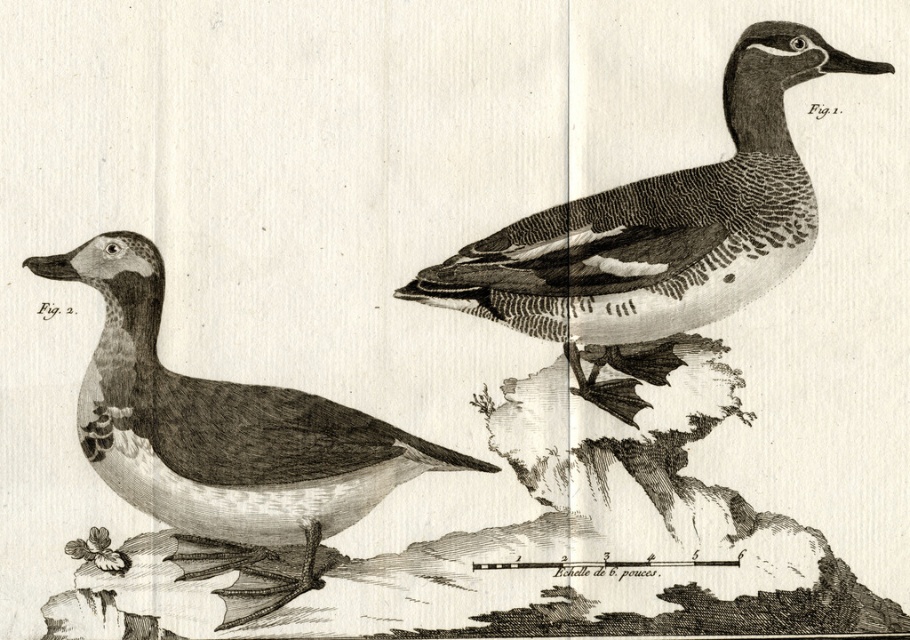
Question: Which point is farther from the camera taking this photo?

Choices:
 (A) pos(281,541)
 (B) pos(737,282)

Answer: (B)

Question: Which point is closer to the camera?

Choices:
 (A) (261, 596)
 (B) (777, 161)

Answer: (A)

Question: Is etched wood duck at upper right further to the viewer compared to smooth black duck at left?

Choices:
 (A) yes
 (B) no

Answer: (A)

Question: Can you confirm if etched wood duck at upper right is smaller than smooth black duck at left?

Choices:
 (A) no
 (B) yes

Answer: (A)

Question: Among these objects, which one is farthest from the camera?

Choices:
 (A) smooth black duck at left
 (B) etched wood duck at upper right

Answer: (B)

Question: Is etched wood duck at upper right positioned behind smooth black duck at left?

Choices:
 (A) yes
 (B) no

Answer: (A)